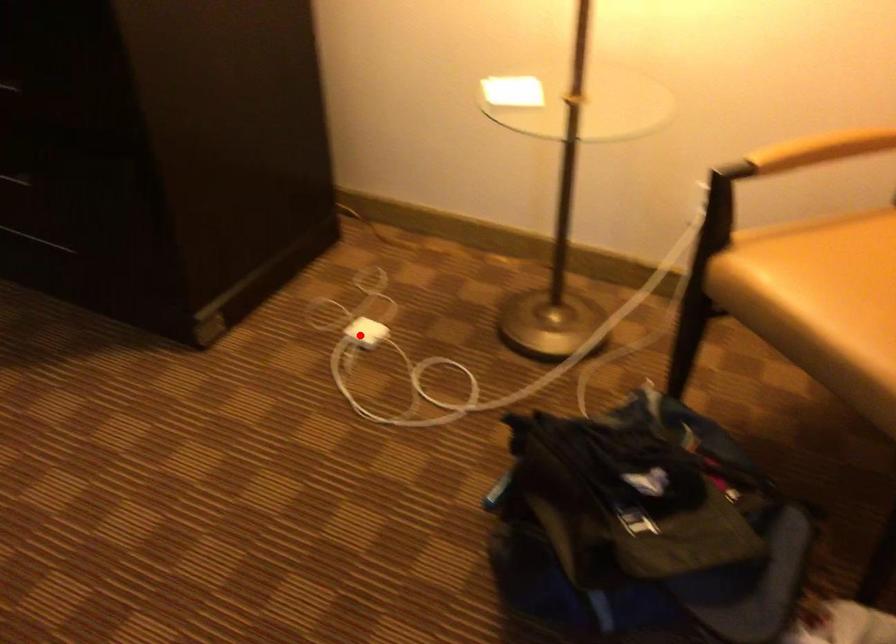
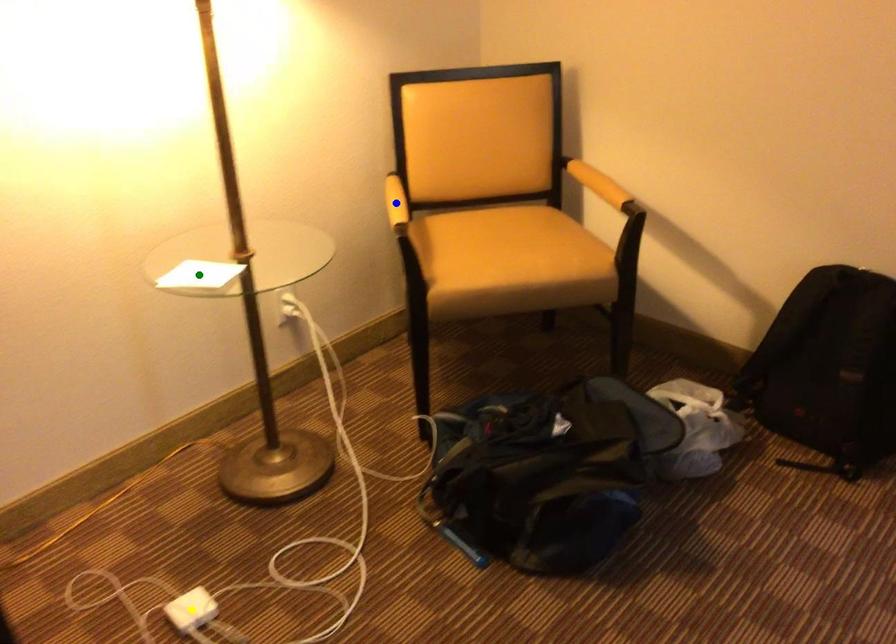
Question: I am providing you with two images of the same scene from different viewpoints. A red point is marked on the first image. You are given multiple points on the second image. In image 2, which mark is for the same physical point as the one in image 1?

Choices:
 (A) yellow point
 (B) blue point
 (C) green point

Answer: (A)